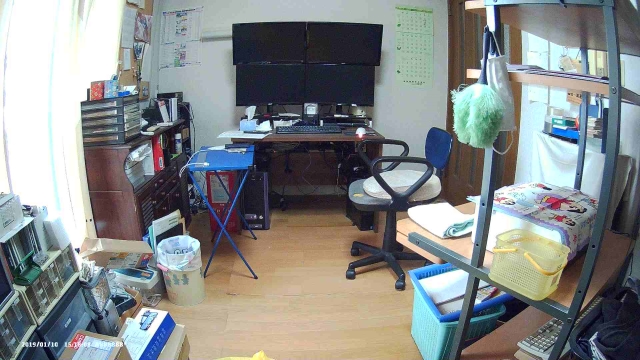
Identify the location of keyboard. (550, 342), (313, 137).